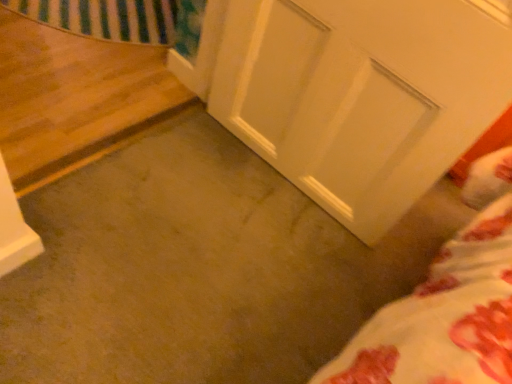
Question: Should I look upward or downward to see carpet at center?

Choices:
 (A) up
 (B) down

Answer: (B)